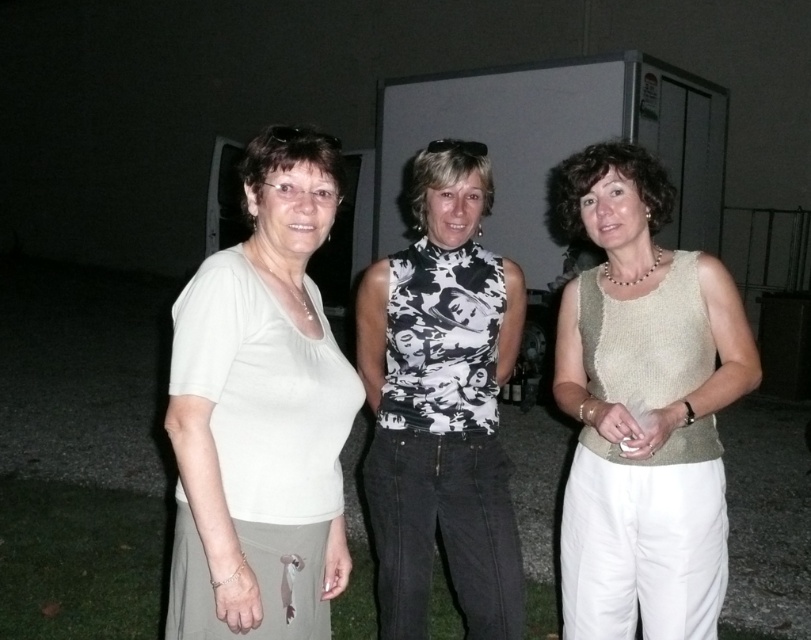
Does white matte shirt at left appear over knitted beige vest at center?

Indeed, white matte shirt at left is positioned over knitted beige vest at center.

From the picture: Which of these two, white matte shirt at left or knitted beige vest at center, stands shorter?

With less height is white matte shirt at left.

At what (x,y) coordinates should I click in order to perform the action: click on white matte shirt at left. Please return your answer as a coordinate pair (x, y). The height and width of the screenshot is (640, 811). Looking at the image, I should click on click(260, 412).

Which of these two, knitted beige vest at center or black printed tank top at center, stands shorter?

With less height is knitted beige vest at center.

Is knitted beige vest at center further to camera compared to black printed tank top at center?

No.

Which is behind, point (582, 442) or point (436, 352)?

The point (436, 352) is more distant.

What are the coordinates of `knitted beige vest at center` in the screenshot? It's located at (644, 410).

From the picture: Which is more to the right, white matte shirt at left or black printed tank top at center?

black printed tank top at center is more to the right.

Does white matte shirt at left have a larger size compared to black printed tank top at center?

No, white matte shirt at left is not bigger than black printed tank top at center.

Is point (316, 168) closer to camera compared to point (496, 376)?

Yes, it is.

What are the coordinates of `white matte shirt at left` in the screenshot? It's located at (260, 412).